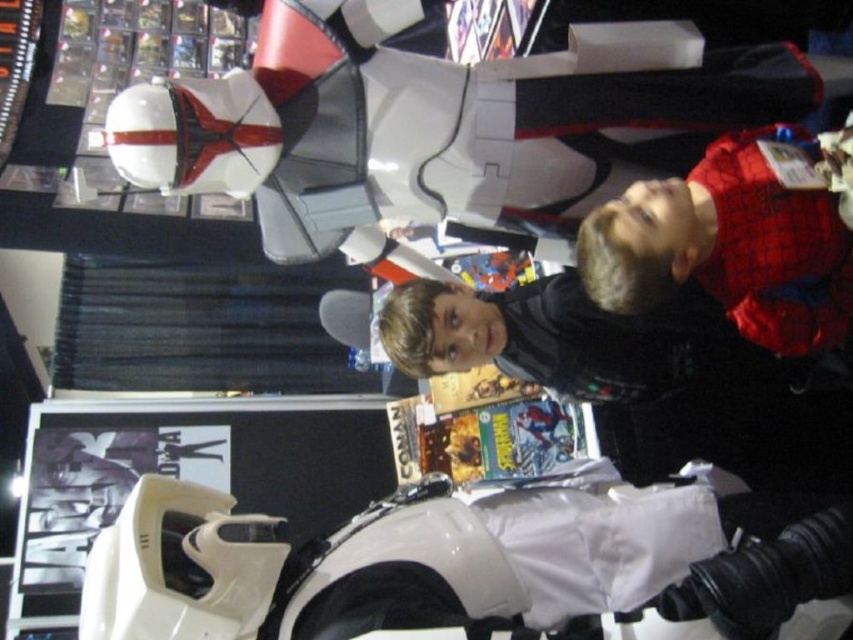
Question: Is white glossy helmet at upper left below matte white astronaut at upper right?

Choices:
 (A) yes
 (B) no

Answer: (B)

Question: In this image, where is white glossy helmet at upper left located relative to white glossy helmet at lower left?

Choices:
 (A) right
 (B) left

Answer: (A)

Question: Which of the following is the closest to the observer?

Choices:
 (A) (335, 172)
 (B) (625, 189)
 (C) (602, 579)

Answer: (C)

Question: Which object is positioned closest to the white glossy helmet at upper left?

Choices:
 (A) white glossy helmet at lower left
 (B) matte white astronaut at upper right

Answer: (B)

Question: Is white glossy helmet at upper left above matte white astronaut at upper right?

Choices:
 (A) no
 (B) yes

Answer: (B)

Question: Which object is closer to the camera taking this photo?

Choices:
 (A) matte white astronaut at upper right
 (B) white glossy helmet at lower left
 (C) white glossy helmet at upper left

Answer: (B)